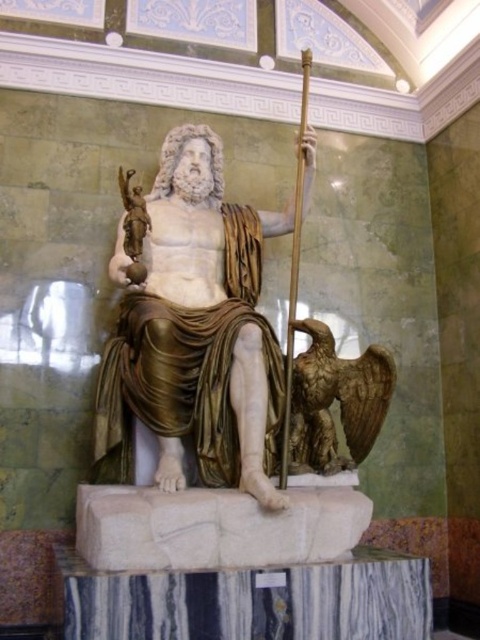
You are an art conservator examining the statue from the front. You notice two points on the statue marked at coordinates point (x=266, y=481) and point (x=315, y=397). Which point is nearer to your viewpoint?

Point (x=266, y=481) is closer to the viewer than point (x=315, y=397).

You are an art student observing the scene. You need to sketch the positions of the white marble statue at center and the bronze eagle at lower right. Which object is positioned higher in the image?

The white marble statue at center is positioned higher than the bronze eagle at lower right.